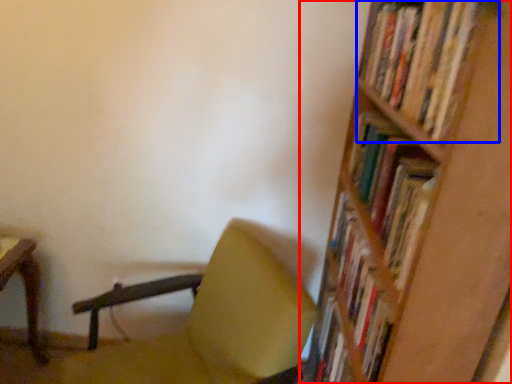
Question: Which object is closer to the camera taking this photo, shelf (highlighted by a red box) or book (highlighted by a blue box)?

Choices:
 (A) shelf
 (B) book

Answer: (A)